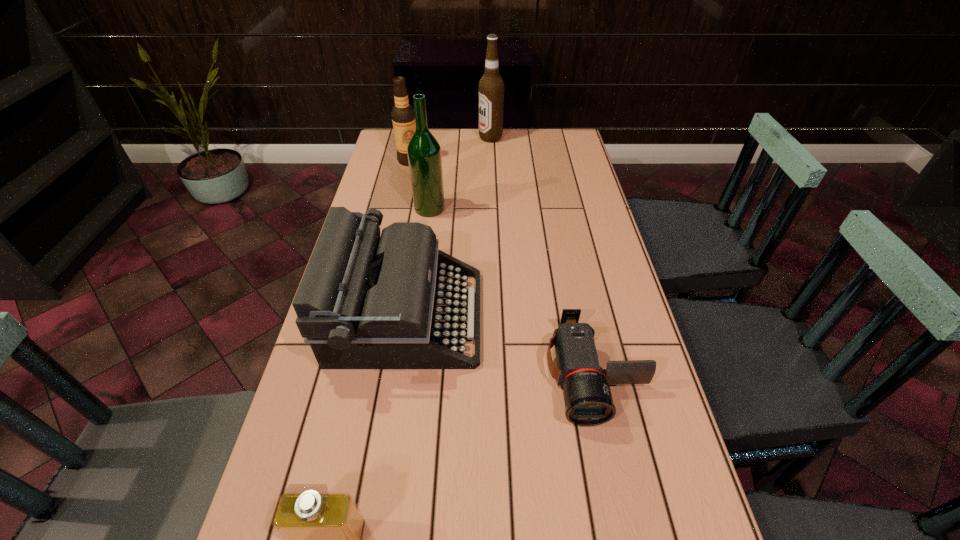
Where is `vacant area situated 0.120m on the label of the farthest object`? vacant area situated 0.120m on the label of the farthest object is located at coordinates (449, 138).

Locate an element on the screen. Image resolution: width=960 pixels, height=540 pixels. free spot located on the label of the farthest object is located at coordinates (454, 138).

The width and height of the screenshot is (960, 540). I want to click on free space located 0.050m on the left of the second alcohol from right to left, so click(x=399, y=208).

Image resolution: width=960 pixels, height=540 pixels. What are the coordinates of `vacant point located on the label of the second nearest alcohol` in the screenshot? It's located at (400, 200).

Locate an element on the screen. free space located on the typing side of the typewriter is located at coordinates (543, 316).

What are the coordinates of `free location located 0.140m on the lens of the shortest object` in the screenshot? It's located at (621, 499).

Locate an element on the screen. This screenshot has height=540, width=960. alcohol located in the left edge section of the desktop is located at coordinates (403, 116).

The image size is (960, 540). I want to click on typewriter that is at the left edge, so click(395, 301).

Find the location of a particular element. The width and height of the screenshot is (960, 540). object located at the right edge is located at coordinates coord(588,401).

This screenshot has width=960, height=540. Find the location of `object that is positioned at the far left corner`. object that is positioned at the far left corner is located at coordinates (403, 116).